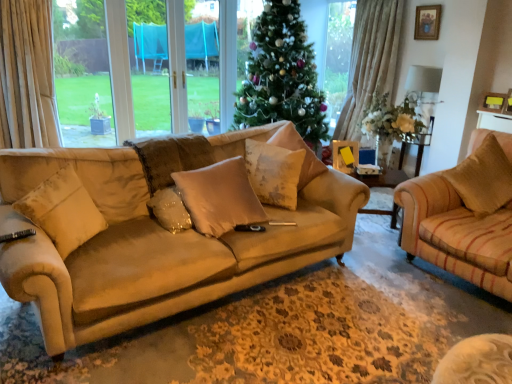
Question: Is there a large distance between fluffy beige pillow at center, which is the third pillow from left to right, and brown textured pillow at right, the 5th pillow positioned from the left?

Choices:
 (A) no
 (B) yes

Answer: (B)

Question: From a real-world perspective, does fluffy beige pillow at center, arranged as the 3th pillow when viewed from the right, stand above brown textured pillow at right, arranged as the 1th pillow when viewed from the right?

Choices:
 (A) yes
 (B) no

Answer: (B)

Question: Considering the relative sizes of fluffy beige pillow at center, which is the third pillow from left to right, and brown textured pillow at right, arranged as the 1th pillow when viewed from the right, in the image provided, is fluffy beige pillow at center, which is the third pillow from left to right, bigger than brown textured pillow at right, arranged as the 1th pillow when viewed from the right,?

Choices:
 (A) yes
 (B) no

Answer: (B)

Question: Does fluffy beige pillow at center, arranged as the 3th pillow when viewed from the right, lie in front of brown textured pillow at right, the 5th pillow positioned from the left?

Choices:
 (A) yes
 (B) no

Answer: (B)

Question: Does fluffy beige pillow at center, arranged as the 3th pillow when viewed from the right, have a smaller size compared to brown textured pillow at right, the 5th pillow positioned from the left?

Choices:
 (A) no
 (B) yes

Answer: (B)

Question: Visually, is green matte christmas tree at center positioned to the left or to the right of wooden picture frame at upper right, the 1th picture frame positioned from the top?

Choices:
 (A) left
 (B) right

Answer: (A)

Question: Do you think green matte christmas tree at center is within wooden picture frame at upper right, arranged as the second picture frame when viewed from the left, or outside of it?

Choices:
 (A) outside
 (B) inside

Answer: (A)

Question: From the image's perspective, is green matte christmas tree at center positioned above or below wooden picture frame at upper right, which appears as the 2th picture frame when ordered from the bottom?

Choices:
 (A) above
 (B) below

Answer: (B)

Question: Is point (248, 64) closer or farther from the camera than point (423, 6)?

Choices:
 (A) closer
 (B) farther

Answer: (B)

Question: Is point (68, 249) positioned closer to the camera than point (362, 211)?

Choices:
 (A) farther
 (B) closer

Answer: (B)

Question: Is beige suede pillow at left, the first pillow from the left, to the left or to the right of wooden side table at center in the image?

Choices:
 (A) right
 (B) left

Answer: (B)

Question: Is beige suede pillow at left, the first pillow from the left, bigger or smaller than wooden side table at center?

Choices:
 (A) big
 (B) small

Answer: (B)

Question: Is beige suede pillow at left, the first pillow from the left, inside or outside of wooden side table at center?

Choices:
 (A) inside
 (B) outside

Answer: (B)

Question: In terms of height, does green matte christmas tree at center look taller or shorter compared to matte yellow picture frame at center, the 1th picture frame in the bottom-to-top sequence?

Choices:
 (A) tall
 (B) short

Answer: (A)

Question: From a real-world perspective, is green matte christmas tree at center positioned above or below matte yellow picture frame at center, the 2th picture frame viewed from the top?

Choices:
 (A) below
 (B) above

Answer: (B)